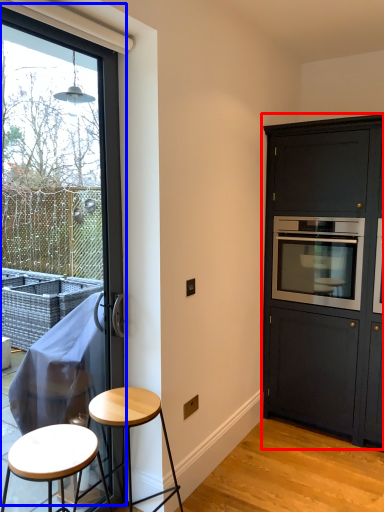
Question: Which object appears farthest to the camera in this image, cabinetry (highlighted by a red box) or window (highlighted by a blue box)?

Choices:
 (A) cabinetry
 (B) window

Answer: (A)